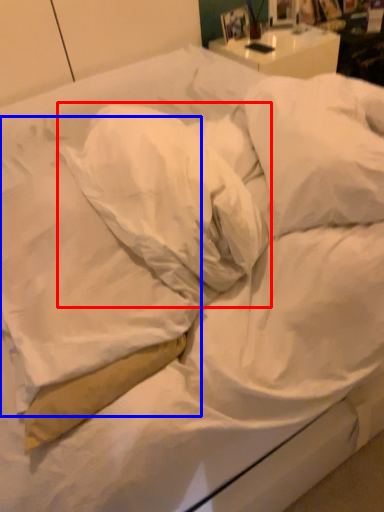
Question: Which point is further to the camera, pillow (highlighted by a red box) or pillow (highlighted by a blue box)?

Choices:
 (A) pillow
 (B) pillow

Answer: (A)